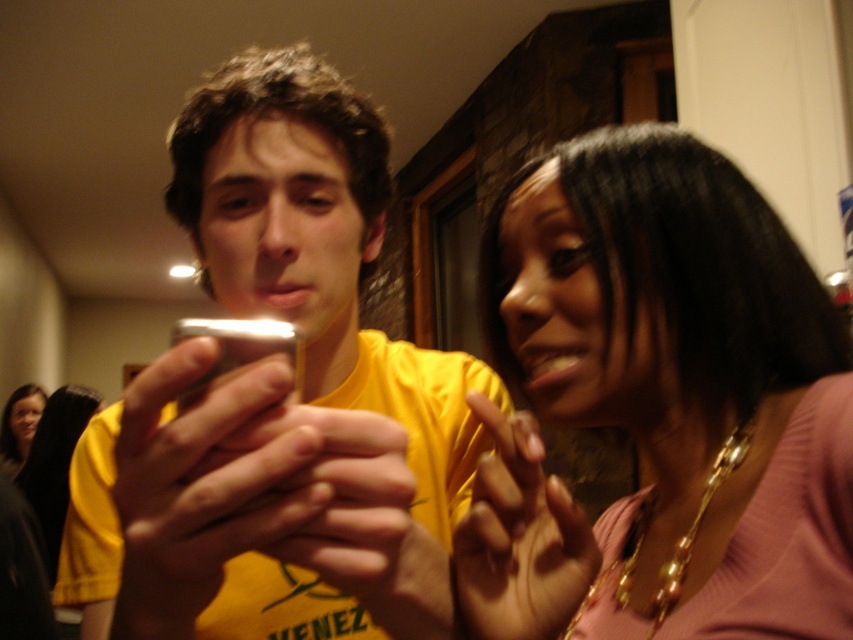
Where is `matte pink sweater at center`? The width and height of the screenshot is (853, 640). matte pink sweater at center is located at coordinates (660, 404).

Is the position of matte pink sweater at center more distant than that of matte black hair at upper left?

That is False.

This screenshot has height=640, width=853. What do you see at coordinates (660, 404) in the screenshot? I see `matte pink sweater at center` at bounding box center [660, 404].

This screenshot has width=853, height=640. In order to click on matte pink sweater at center in this screenshot , I will do `click(660, 404)`.

Does matte yellow shirt at center have a lesser width compared to matte black hair at upper left?

Yes.

Between point (202, 221) and point (38, 396), which one is positioned in front?

Positioned in front is point (202, 221).

Which is in front, point (386, 477) or point (4, 417)?

Point (386, 477) is more forward.

I want to click on matte yellow shirt at center, so click(277, 397).

Does matte pink sweater at center appear over matte yellow shirt at center?

Actually, matte pink sweater at center is below matte yellow shirt at center.

Based on the photo, is matte pink sweater at center positioned at the back of matte yellow shirt at center?

Yes, matte pink sweater at center is further from the viewer.

Is point (788, 317) more distant than point (311, 544)?

Yes, it is.

Locate an element on the screen. matte pink sweater at center is located at coordinates (660, 404).